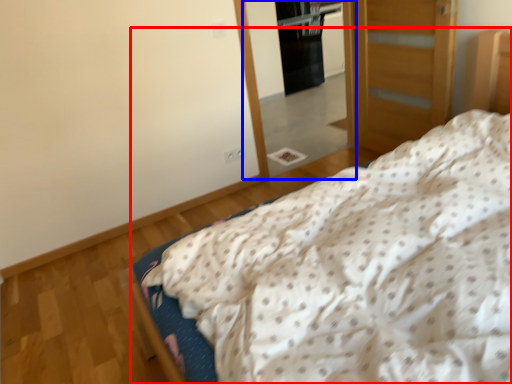
Question: Which object is further to the camera taking this photo, bed (highlighted by a red box) or mirror (highlighted by a blue box)?

Choices:
 (A) bed
 (B) mirror

Answer: (B)